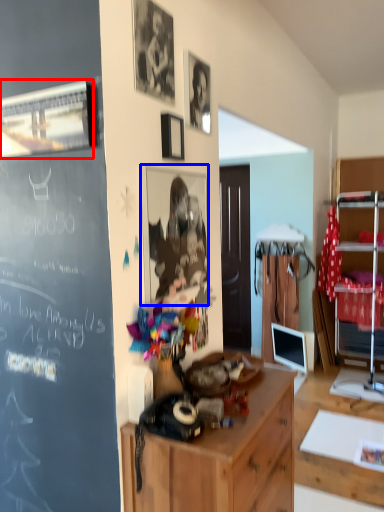
Question: Among these objects, which one is nearest to the camera, picture frame (highlighted by a red box) or picture frame (highlighted by a blue box)?

Choices:
 (A) picture frame
 (B) picture frame

Answer: (A)